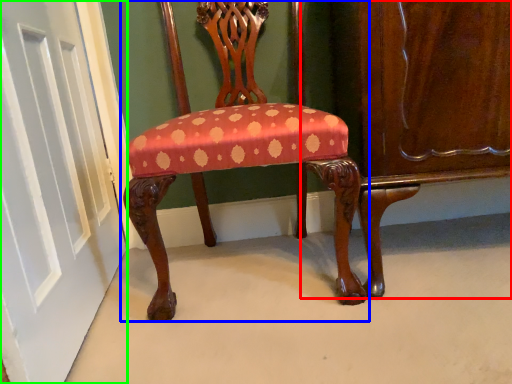
Question: Based on their relative distances, which object is nearer to dresser (highlighted by a red box)? Choose from chair (highlighted by a blue box) and door (highlighted by a green box).

Choices:
 (A) chair
 (B) door

Answer: (A)